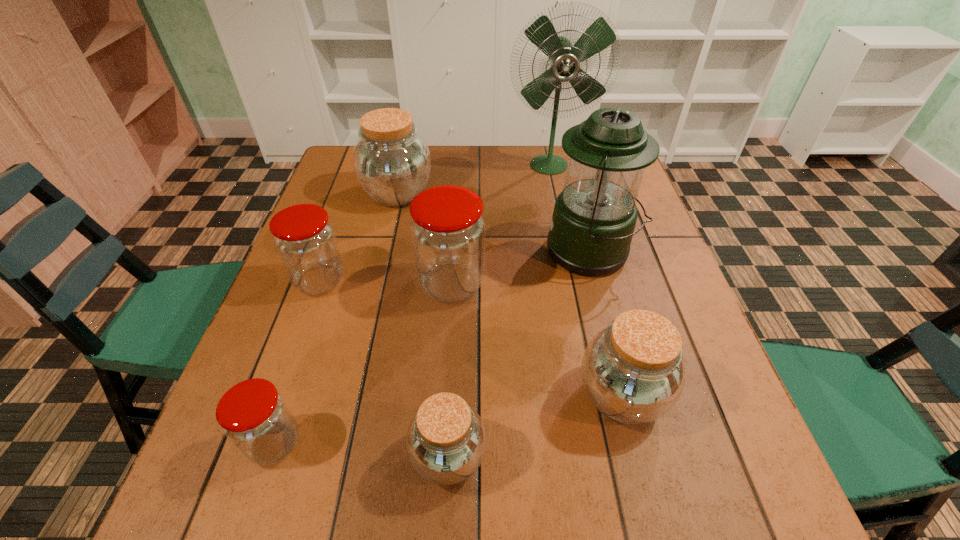
Find the location of `vacant space that satisfies the following two spatial constraints: 1. on the front side of the leftmost brown jar; 2. on the left side of the biggest red jar`. vacant space that satisfies the following two spatial constraints: 1. on the front side of the leftmost brown jar; 2. on the left side of the biggest red jar is located at coordinates (377, 284).

Where is `free spot that satisfies the following two spatial constraints: 1. on the back side of the seventh shortest object; 2. on the left side of the smallest brown jar`? free spot that satisfies the following two spatial constraints: 1. on the back side of the seventh shortest object; 2. on the left side of the smallest brown jar is located at coordinates (459, 252).